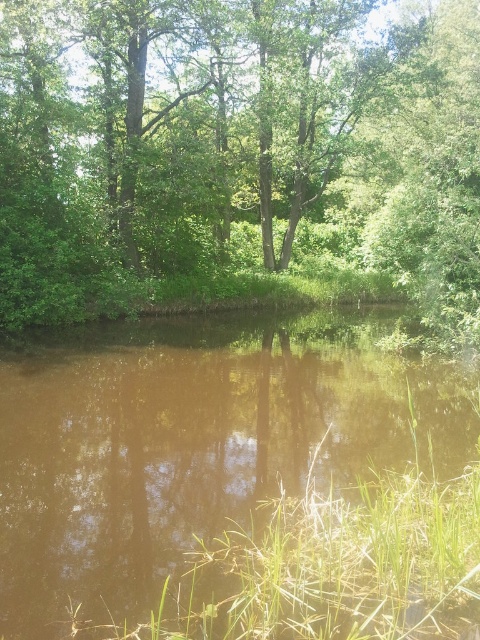
Can you confirm if green leafy tree at center is smaller than brown murky water at center?

No.

Which is above, green leafy tree at center or brown murky water at center?

green leafy tree at center is higher up.

Find the location of `green leafy tree at center`. green leafy tree at center is located at coordinates (238, 154).